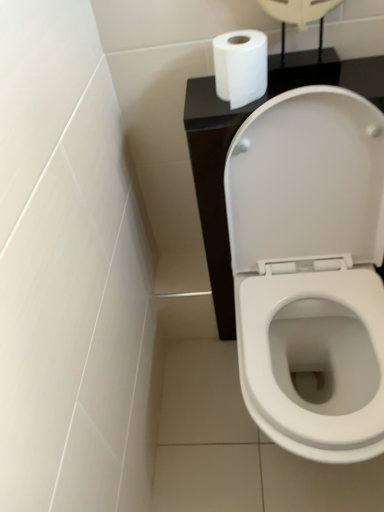
Question: Does point (264, 37) appear closer or farther from the camera than point (240, 170)?

Choices:
 (A) farther
 (B) closer

Answer: (B)

Question: Do you think white matte toilet paper at upper right is within white glossy toilet at center, or outside of it?

Choices:
 (A) outside
 (B) inside

Answer: (A)

Question: In terms of height, does white matte toilet paper at upper right look taller or shorter compared to white glossy toilet at center?

Choices:
 (A) tall
 (B) short

Answer: (B)

Question: From the image's perspective, is white glossy toilet at center positioned above or below white matte toilet paper at upper right?

Choices:
 (A) above
 (B) below

Answer: (B)

Question: Relative to white matte toilet paper at upper right, is white glossy toilet at center in front or behind?

Choices:
 (A) behind
 (B) front

Answer: (B)

Question: Considering the positions of point (365, 121) and point (231, 57), is point (365, 121) closer or farther from the camera than point (231, 57)?

Choices:
 (A) farther
 (B) closer

Answer: (A)

Question: Would you say white glossy toilet at center is inside or outside white matte toilet paper at upper right?

Choices:
 (A) outside
 (B) inside

Answer: (A)